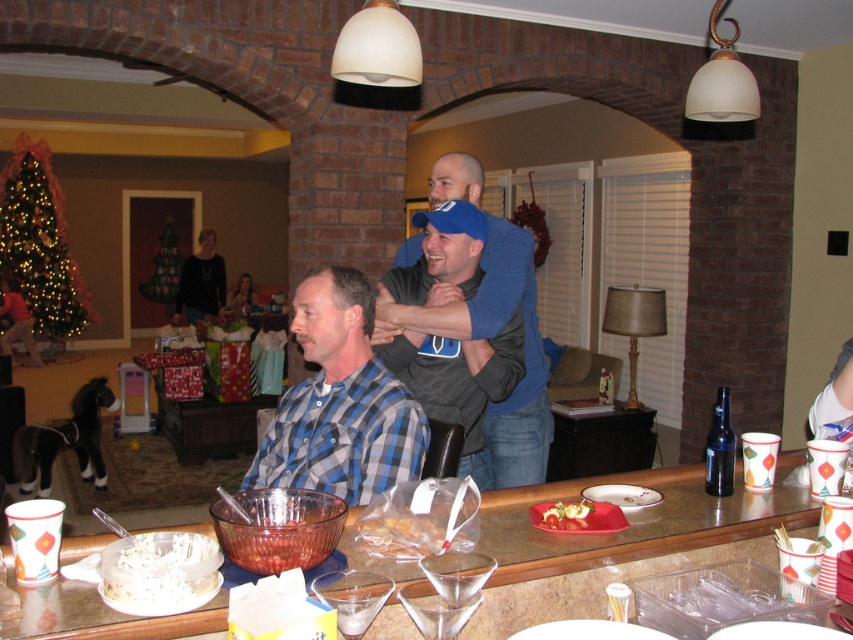
Between point (605, 557) and point (196, 308), which one is positioned in front?

Positioned in front is point (605, 557).

Is translucent glass table at center wider than black sweater at upper left?

Yes.

Does point (183, 618) come behind point (215, 285)?

No.

Identify the location of translucent glass table at center. (637, 522).

How much distance is there between translucent glass table at center and white crumbly cake at lower left?

19.09 inches

Is translucent glass table at center closer to the viewer compared to white crumbly cake at lower left?

No, it is not.

Does point (622, 477) lie behind point (120, 596)?

Yes, it is.

This screenshot has width=853, height=640. Identify the location of translucent glass table at center. (637, 522).

Can you confirm if translucent glass table at center is shorter than smooth white cheese at center?

In fact, translucent glass table at center may be taller than smooth white cheese at center.

Can you confirm if translucent glass table at center is taller than smooth white cheese at center?

Indeed, translucent glass table at center has a greater height compared to smooth white cheese at center.

Is point (699, 474) positioned behind point (570, 518)?

Yes, point (699, 474) is farther from viewer.

This screenshot has width=853, height=640. I want to click on translucent glass table at center, so click(x=637, y=522).